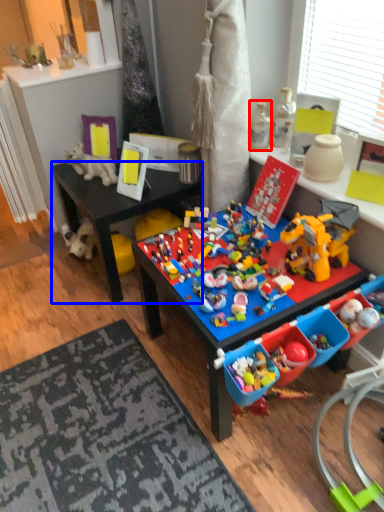
Question: Which point is closer to the camera, toy (highlighted by a red box) or desk (highlighted by a blue box)?

Choices:
 (A) toy
 (B) desk

Answer: (A)